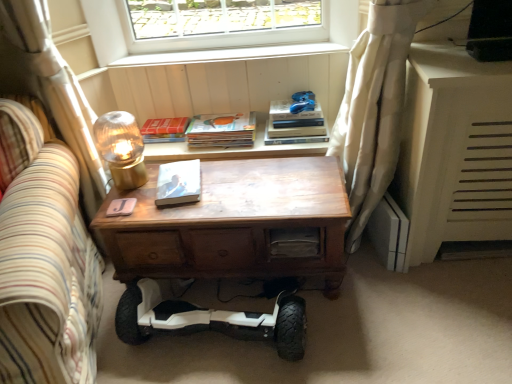
Identify the location of vacant space to the right of matte white book at center, placed as the first paperback book when sorted from bottom to top. click(x=222, y=183).